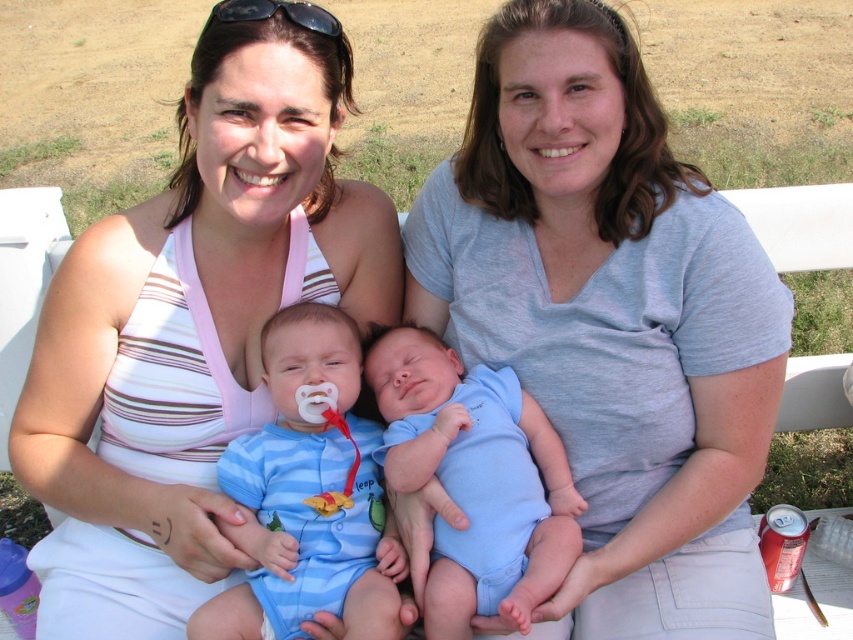
Can you confirm if white striped tank top at center is thinner than blue soft fabric newborn at center?

Incorrect, white striped tank top at center's width is not less than blue soft fabric newborn at center's.

Who is shorter, white striped tank top at center or blue soft fabric newborn at center?

Standing shorter between the two is blue soft fabric newborn at center.

Does point (300, 278) come behind point (436, 342)?

That is True.

Identify the location of white striped tank top at center. (190, 332).

Between gray cotton shirt at center and white striped tank top at center, which one has more height?

gray cotton shirt at center

Is point (724, 400) in front of point (181, 417)?

That is True.

Identify the location of gray cotton shirt at center. This screenshot has width=853, height=640. (611, 320).

Is white striped tank top at center smaller than blue cotton onesie at center?

No, white striped tank top at center is not smaller than blue cotton onesie at center.

Which is in front, point (323, 141) or point (277, 468)?

Point (277, 468)

From the picture: Who is more distant from viewer, (195, 300) or (273, 524)?

Point (195, 300)

Identify the location of white striped tank top at center. (190, 332).